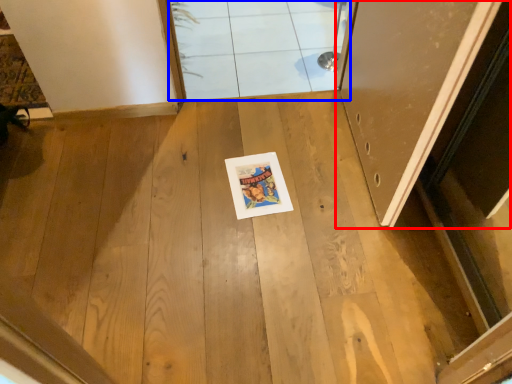
Question: Which object appears closest to the camera in this image, door (highlighted by a red box) or window (highlighted by a blue box)?

Choices:
 (A) door
 (B) window

Answer: (A)